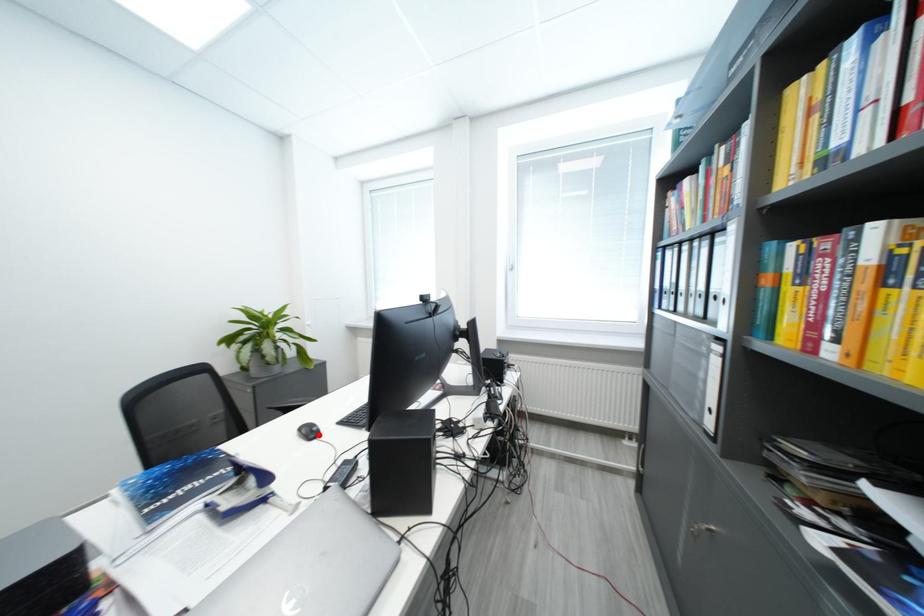
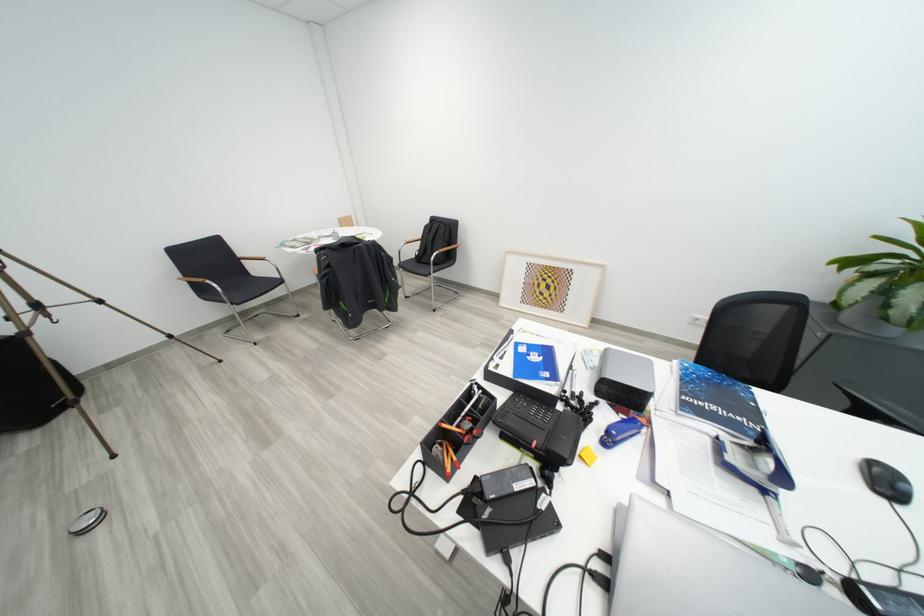
The point at the highlighted location is marked in the first image. Where is the corresponding point in the second image?

(895, 485)